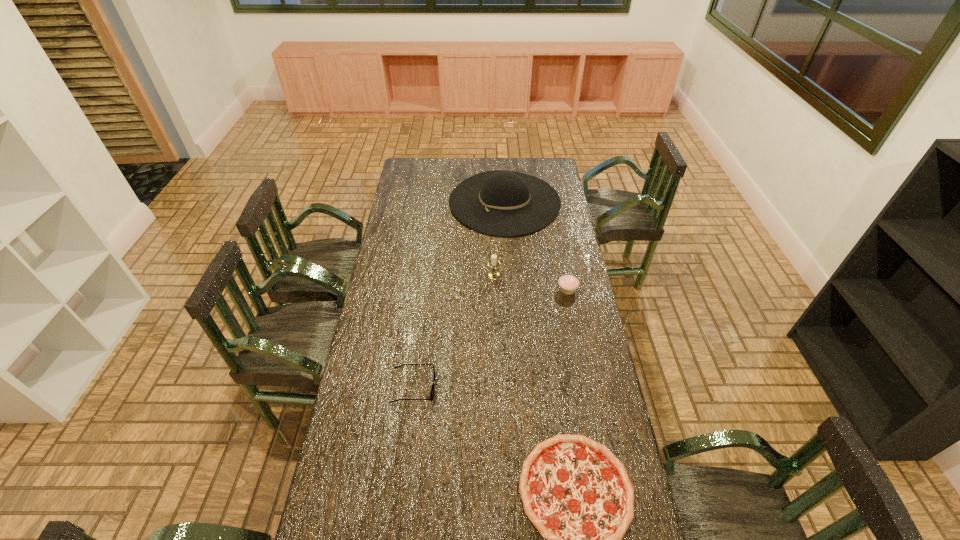
Identify the location of free space at the far left corner of the desktop. (426, 168).

Image resolution: width=960 pixels, height=540 pixels. In the image, there is a desktop. Find the location of `vacant space at the far right corner`. vacant space at the far right corner is located at coordinates (529, 164).

At what (x,y) coordinates should I click in order to perform the action: click on vacant point located between the spectacles and the tallest object. Please return your answer as a coordinate pair (x, y). Looking at the image, I should click on (459, 294).

You are a GUI agent. You are given a task and a screenshot of the screen. Output one action in this format:
    pyautogui.click(x=<x>, y=<y>)
    Task: Click on the empty space between the farthest object and the candle holder
    The width and height of the screenshot is (960, 540).
    Given the screenshot: What is the action you would take?
    pyautogui.click(x=499, y=239)

The width and height of the screenshot is (960, 540). In order to click on free space between the third farthest object and the fourth farthest object in this screenshot , I will do `click(491, 338)`.

Where is `free space between the sombrero and the cupcake`? Image resolution: width=960 pixels, height=540 pixels. free space between the sombrero and the cupcake is located at coordinates (x=536, y=246).

Where is `free space between the farthest object and the fourth farthest object`? The width and height of the screenshot is (960, 540). free space between the farthest object and the fourth farthest object is located at coordinates (459, 294).

At what (x,y) coordinates should I click in order to perform the action: click on vacant space that's between the third nearest object and the sombrero. Please return your answer as a coordinate pair (x, y). Looking at the image, I should click on (536, 246).

This screenshot has width=960, height=540. I want to click on vacant point located between the tallest object and the spectacles, so click(x=459, y=294).

Find the location of `object that is the third closest to the tallest object`. object that is the third closest to the tallest object is located at coordinates (432, 391).